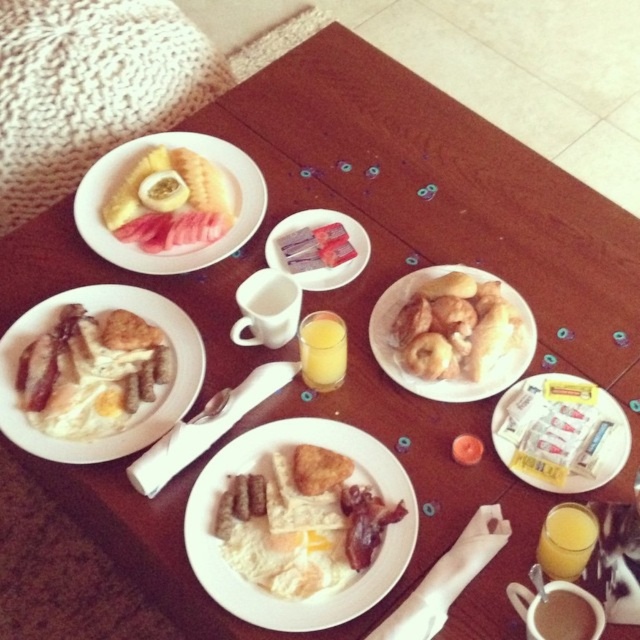
You are standing at the edge of the table and want to grab the translucent glass cup of orange juice at bottom right. Considering your hand can reach 28 inches, can you reach it?

The translucent glass cup of orange juice at bottom right is 31.17 inches away from the viewer, which is beyond the 28 inches reach of your hand. Therefore, you cannot reach it.

You are a child who wants to reach for the golden brown doughnuts at center and the translucent glass cup of orange juice at center on the table. Which one is taller?

The golden brown doughnuts at center is much taller than the translucent glass cup of orange juice at center.

You are sitting at the wooden table and want to reach both the point at coordinates point (577,518) and the point at coordinates point (296,253). Which point will you reach first if you extend your arm straight out?

You will reach point (577,518) first because it is closer to you than point (296,253).